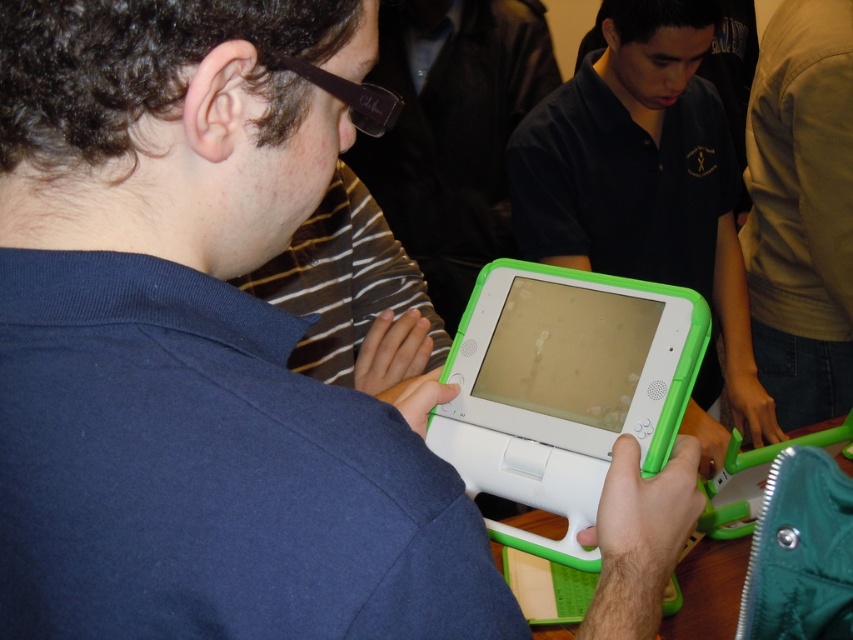
Does matte green tablet at center have a greater height compared to white plastic tablet at center?

Yes, matte green tablet at center is taller than white plastic tablet at center.

What do you see at coordinates (643, 177) in the screenshot?
I see `matte green tablet at center` at bounding box center [643, 177].

Is point (604, 61) more distant than point (553, 499)?

Yes.

Locate an element on the screen. This screenshot has width=853, height=640. matte green tablet at center is located at coordinates (643, 177).